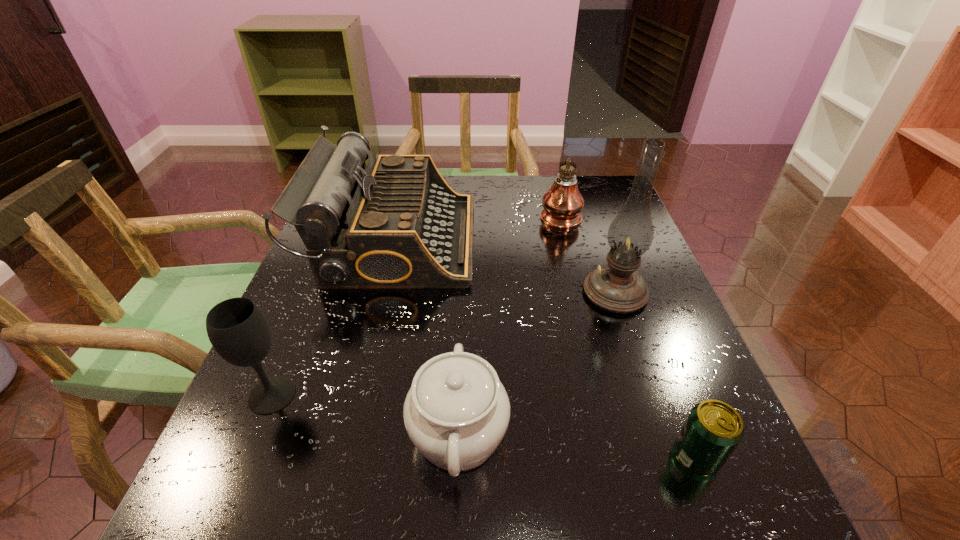
Locate an element on the screen. This screenshot has height=540, width=960. vacant area that lies between the typewriter and the shorter oil lamp is located at coordinates (477, 227).

Find the location of a particular element. The height and width of the screenshot is (540, 960). free space between the wineglass and the shorter oil lamp is located at coordinates (417, 305).

Where is `free space between the taller oil lamp and the wineglass`? free space between the taller oil lamp and the wineglass is located at coordinates (444, 343).

What are the coordinates of `free space between the chinaware and the wineglass` in the screenshot? It's located at pos(365,414).

At what (x,y) coordinates should I click in order to perform the action: click on empty space between the farther oil lamp and the taller oil lamp. Please return your answer as a coordinate pair (x, y). Image resolution: width=960 pixels, height=540 pixels. Looking at the image, I should click on pos(588,253).

In order to click on free spot between the tallest object and the farther oil lamp in this screenshot , I will do `click(588, 253)`.

Find the location of a particular element. The width and height of the screenshot is (960, 540). unoccupied area between the taller oil lamp and the typewriter is located at coordinates (505, 266).

At what (x,y) coordinates should I click in order to perform the action: click on unoccupied position between the wineglass and the typewriter. Please return your answer as a coordinate pair (x, y). Looking at the image, I should click on (333, 318).

Locate an element on the screen. The height and width of the screenshot is (540, 960). vacant point located between the shortest object and the tallest object is located at coordinates click(x=656, y=374).

What are the coordinates of `the fourth closest object to the typewriter` in the screenshot? It's located at (617, 287).